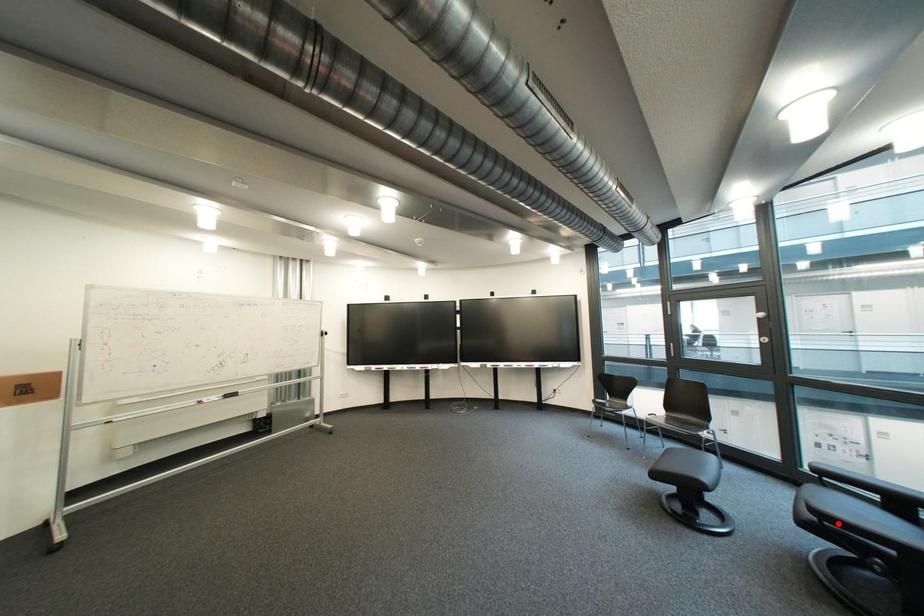
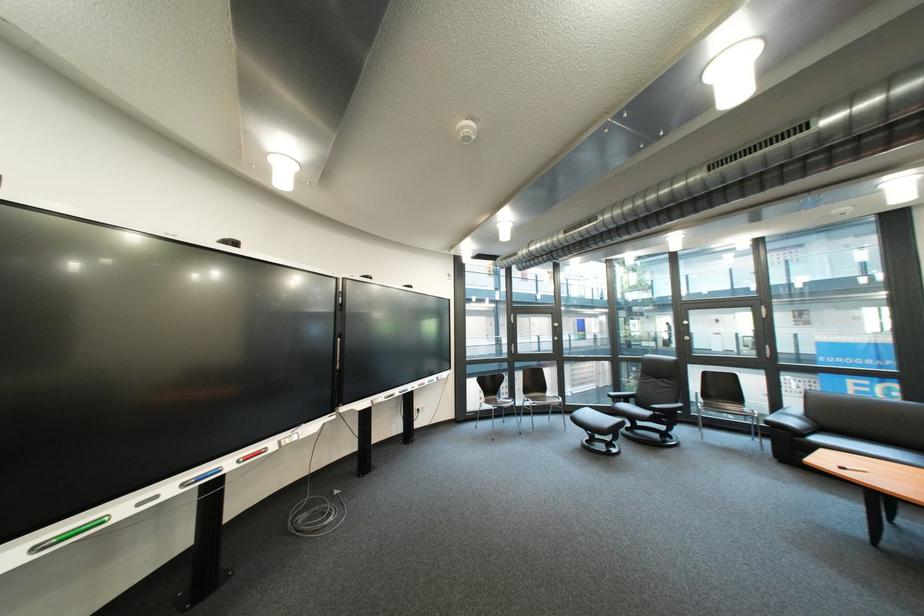
Question: A red point is marked in image1. In image2, is the corresponding 3D point closer to the camera or farther? Reply with the corresponding letter.

Choices:
 (A) The corresponding 3D point is closer.
 (B) The corresponding 3D point is farther.

Answer: (B)